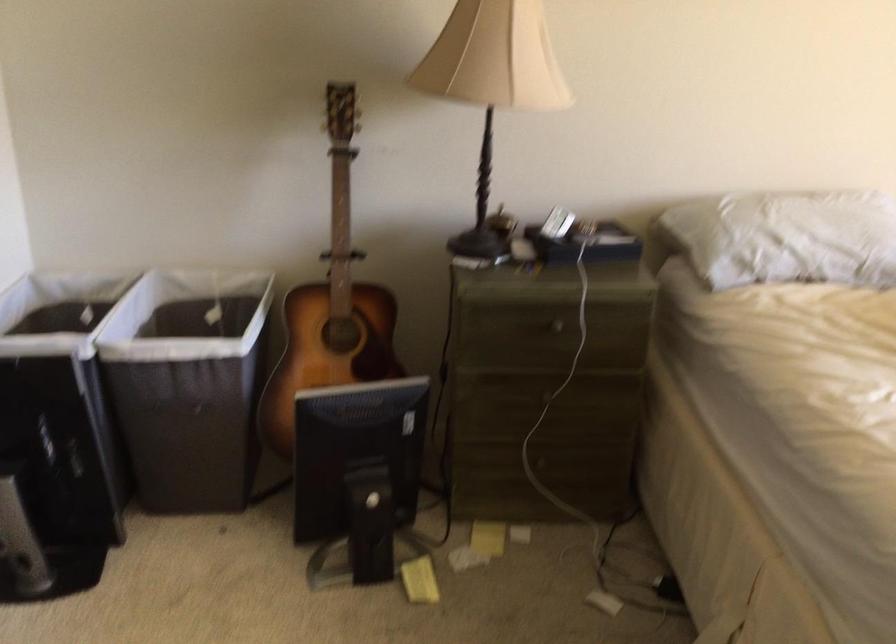
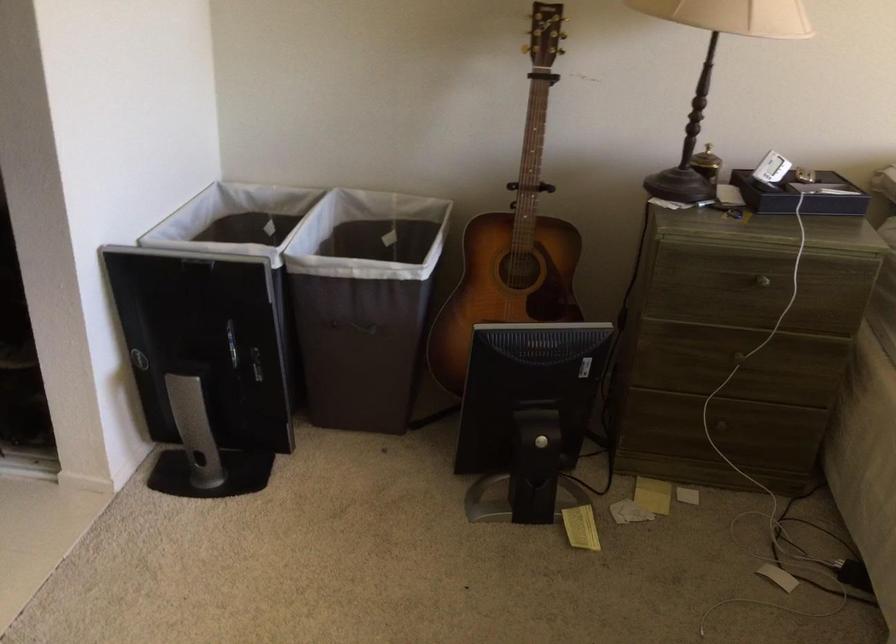
Locate, in the second image, the point that corresponds to the point at 501,140 in the first image.

(714, 69)